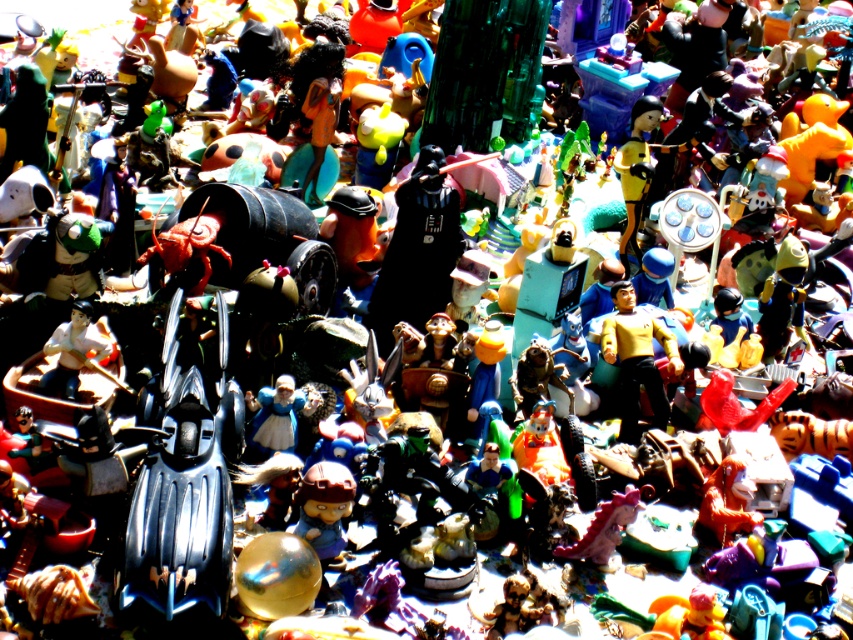
From the picture: You are a collector trying to fit a new toy into your display. You have a yellow matte starship at center and a matte brown figurine at center. Which toy occupies more horizontal space in the display?

The yellow matte starship at center might be wider than matte brown figurine at center, so it likely takes up more horizontal space.